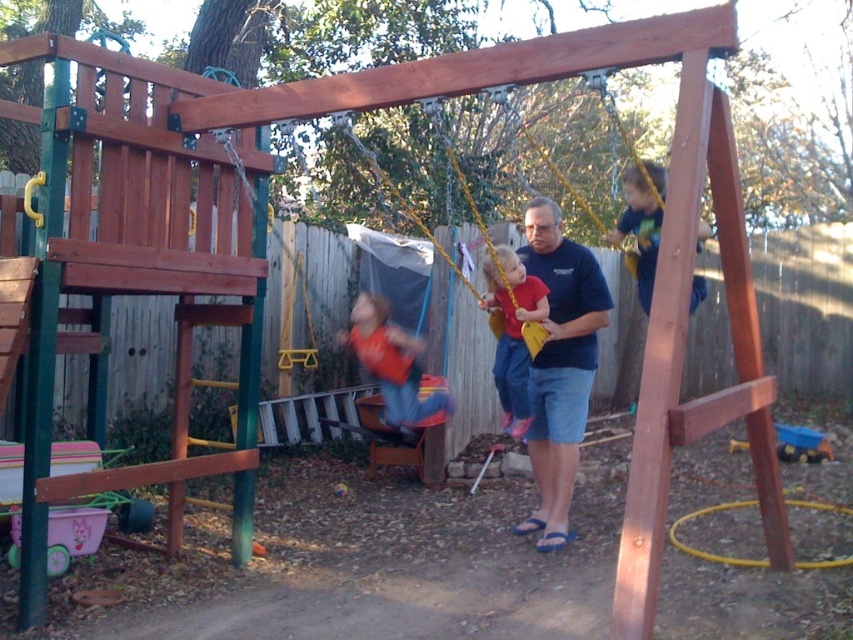
Is dark blue t-shirt at center taller than matte yellow swing at center?

Yes.

Can you confirm if dark blue t-shirt at center is positioned to the left of matte yellow swing at center?

In fact, dark blue t-shirt at center is to the right of matte yellow swing at center.

Is point (527, 218) farther from viewer compared to point (489, 273)?

No, (527, 218) is closer to viewer.

The height and width of the screenshot is (640, 853). What are the coordinates of `dark blue t-shirt at center` in the screenshot? It's located at (560, 364).

Can you confirm if dark blue t-shirt at center is thinner than matte red swing at center?

Yes, dark blue t-shirt at center is thinner than matte red swing at center.

Can you confirm if dark blue t-shirt at center is smaller than matte red swing at center?

No.

Which is in front, point (535, 237) or point (378, 317)?

Point (535, 237)

Locate an element on the screen. This screenshot has width=853, height=640. dark blue t-shirt at center is located at coordinates (560, 364).

Does matte red swing at center appear over yellow fabric swing at center?

Incorrect, matte red swing at center is not positioned above yellow fabric swing at center.

Is matte red swing at center closer to camera compared to yellow fabric swing at center?

No, matte red swing at center is further to the viewer.

This screenshot has height=640, width=853. I want to click on matte red swing at center, so click(393, 364).